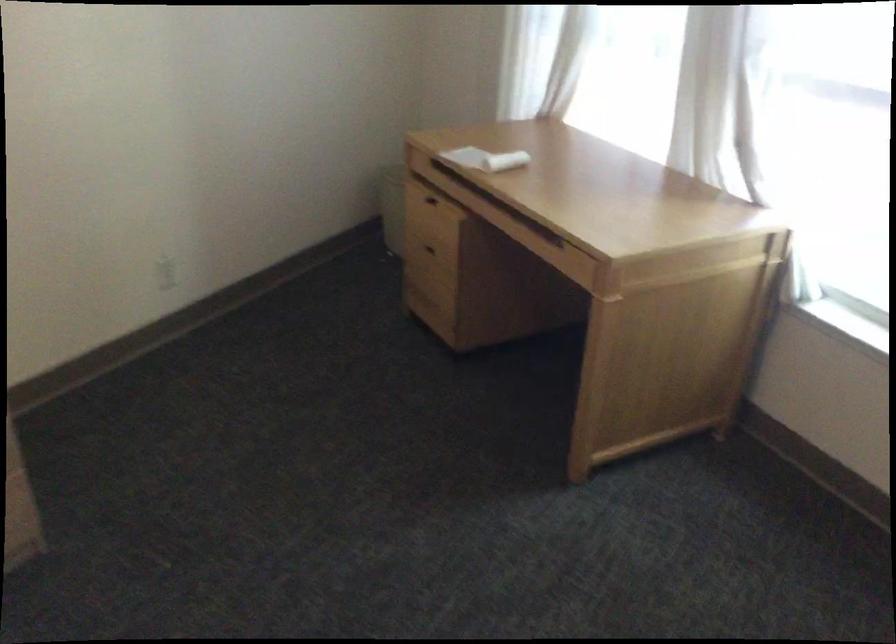
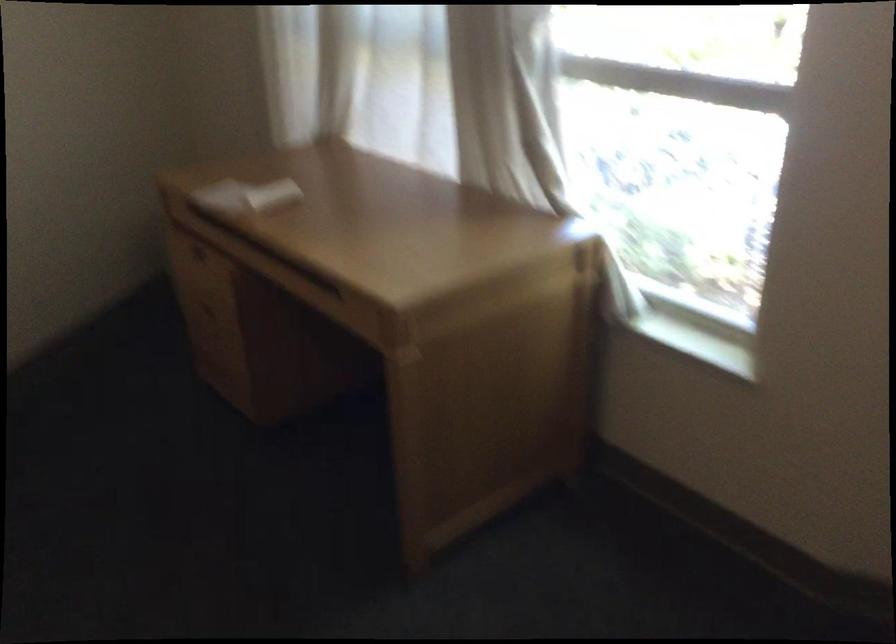
The point at (x=553, y=240) is marked in the first image. Where is the corresponding point in the second image?

(332, 289)